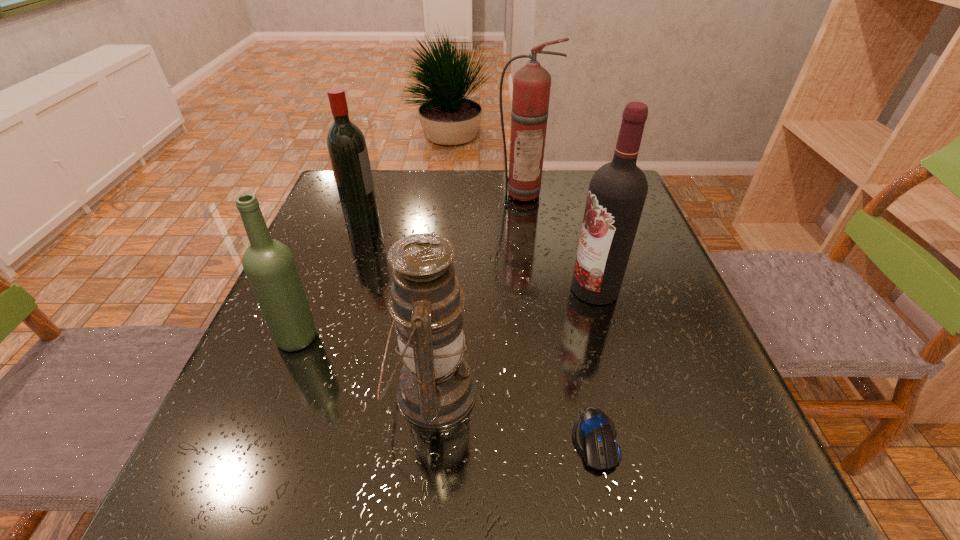
You are a GUI agent. You are given a task and a screenshot of the screen. Output one action in this format:
    pyautogui.click(x=<x>, y=<y>)
    Task: Click on the fire extinguisher
    Image resolution: width=960 pixels, height=540 pixels.
    Given the screenshot: What is the action you would take?
    [x=531, y=85]

The image size is (960, 540). In order to click on the fourth nearest object in this screenshot , I will do `click(617, 192)`.

Where is `the tallest wine bottle`? This screenshot has width=960, height=540. the tallest wine bottle is located at coordinates (617, 192).

Image resolution: width=960 pixels, height=540 pixels. What are the coordinates of `the farthest wine bottle` in the screenshot? It's located at (347, 148).

What are the coordinates of `oil lamp` in the screenshot? It's located at (436, 389).

The width and height of the screenshot is (960, 540). I want to click on the nearest wine bottle, so click(x=269, y=265).

You are a GUI agent. You are given a task and a screenshot of the screen. Output one action in this format:
    pyautogui.click(x=<x>, y=<y>)
    Task: Click on the computer mouse
    The image size is (960, 540).
    Given the screenshot: What is the action you would take?
    pyautogui.click(x=594, y=434)

Identify the location of free location located on the side of the farthest object with the label and nozzle. (537, 286).

You are a GUI agent. You are given a task and a screenshot of the screen. Output one action in this format:
    pyautogui.click(x=<x>, y=<y>)
    Task: Click on the free space located 0.230m on the label of the tallest wine bottle
    Image resolution: width=960 pixels, height=540 pixels.
    Given the screenshot: What is the action you would take?
    pyautogui.click(x=466, y=289)

This screenshot has height=540, width=960. In order to click on free location located on the label of the tallest wine bottle in this screenshot , I will do `click(456, 289)`.